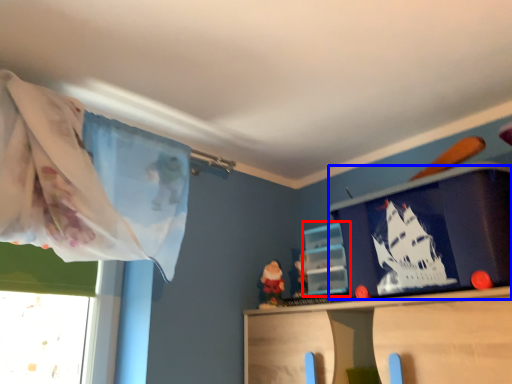
Question: Which object appears closest to the camera in this image, shelf (highlighted by a red box) or window screen (highlighted by a blue box)?

Choices:
 (A) shelf
 (B) window screen

Answer: (B)